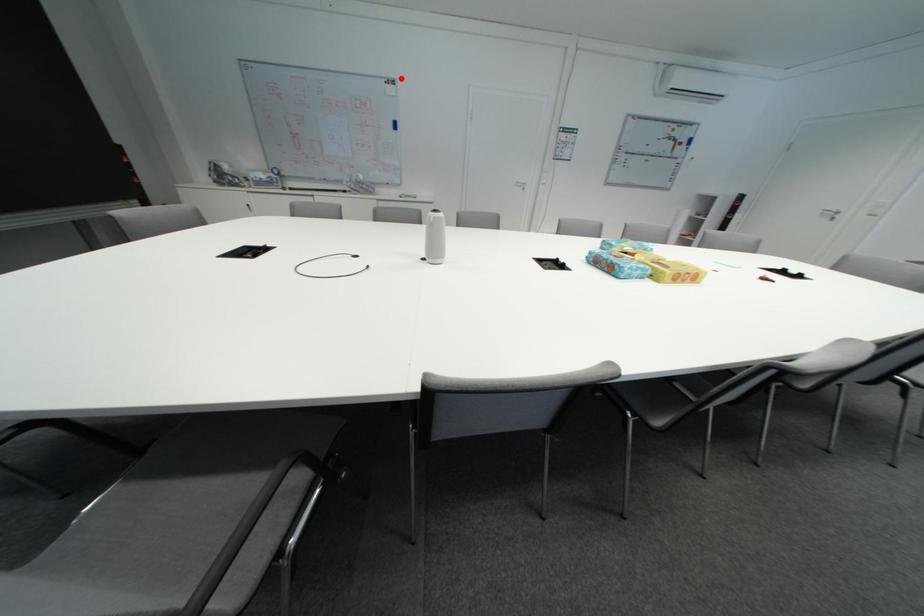
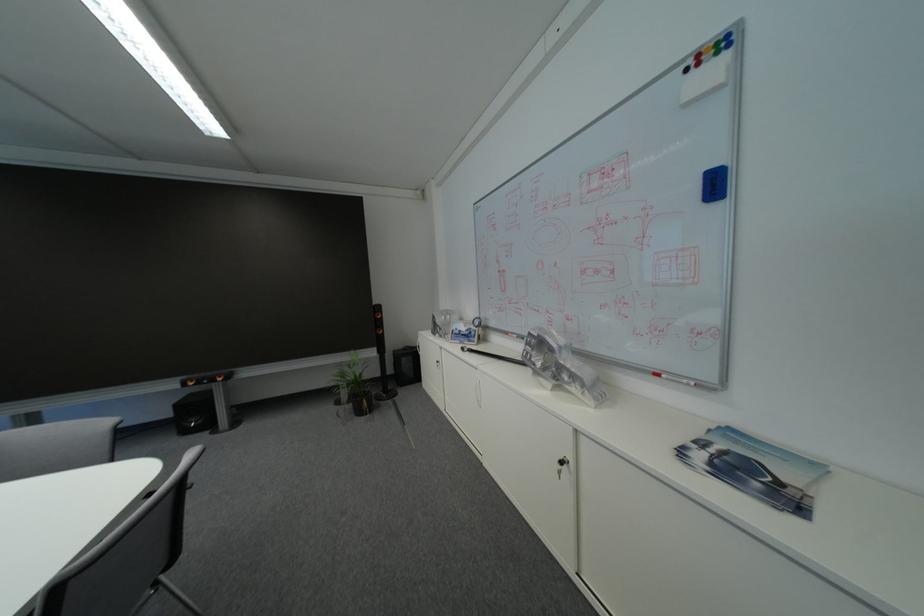
Find the pixel in the second image that matches the highlighted location in the first image.

(723, 34)